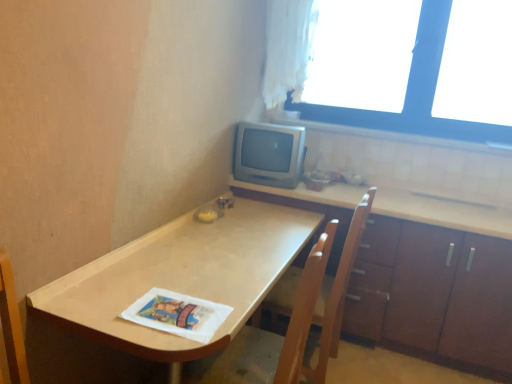
Where is `free space in front of white paper magazine at lower center`? free space in front of white paper magazine at lower center is located at coordinates (162, 342).